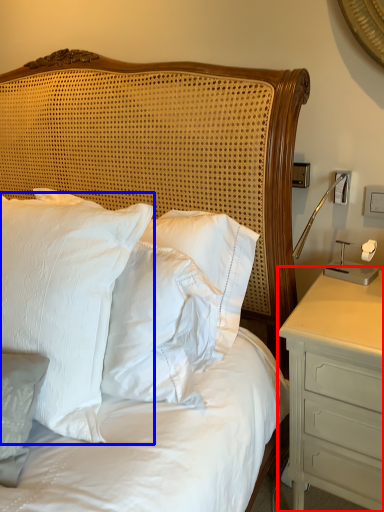
Question: Which of the following is the closest to the observer, nightstand (highlighted by a red box) or pillow (highlighted by a blue box)?

Choices:
 (A) nightstand
 (B) pillow

Answer: (B)